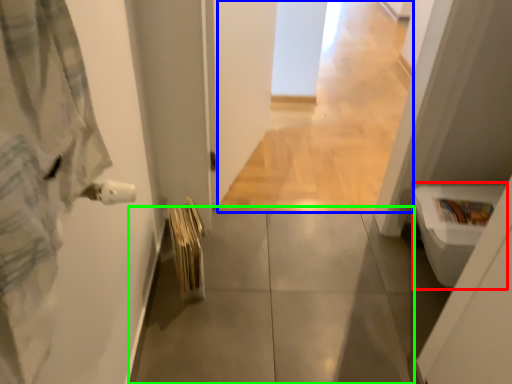
Question: Which is farther away from toilet bowl (highlighted by a red box)? corridor (highlighted by a blue box) or concrete (highlighted by a green box)?

Choices:
 (A) corridor
 (B) concrete

Answer: (A)